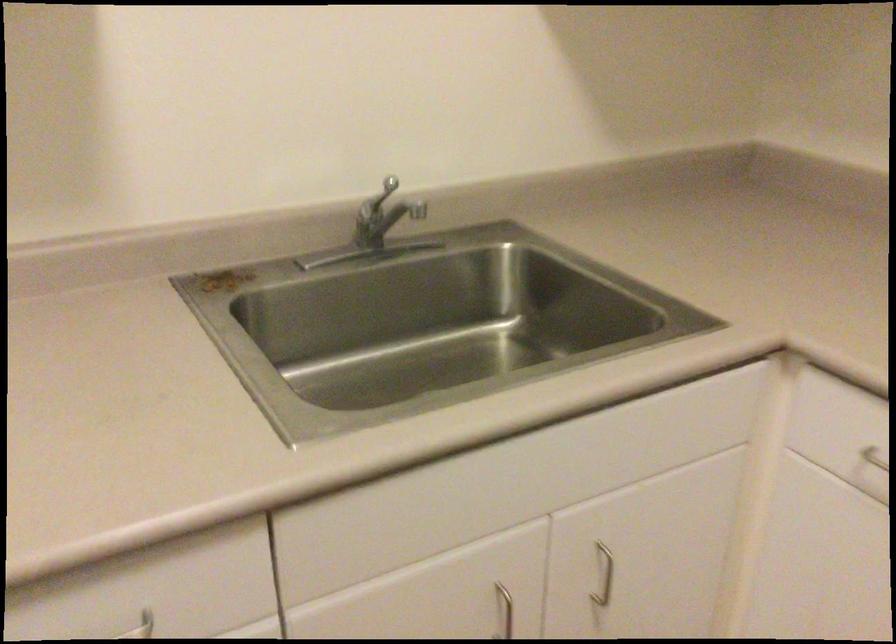
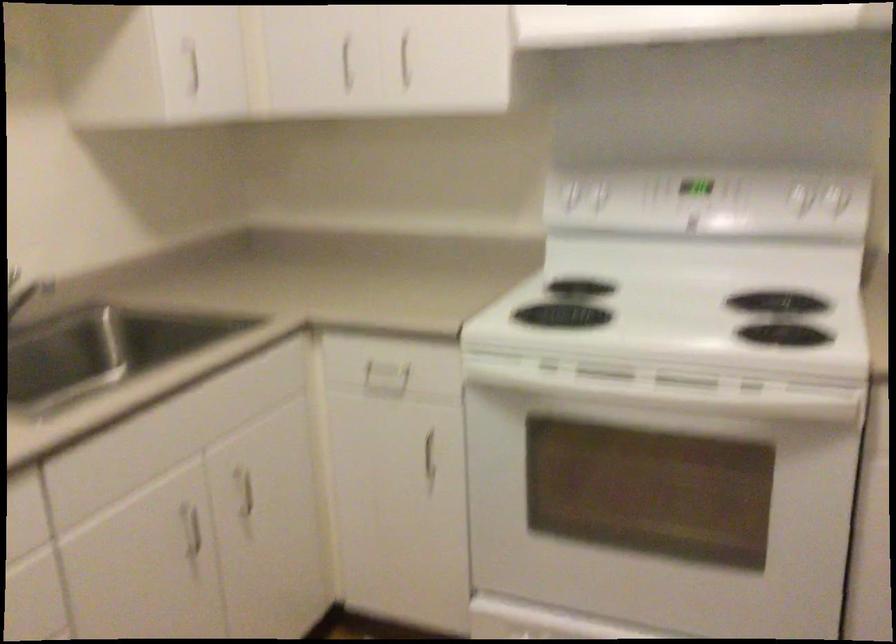
Question: Based on the continuous images, in which direction is the camera rotating? Reply with the corresponding letter.

Choices:
 (A) Left
 (B) Right
 (C) Up
 (D) Down

Answer: (B)